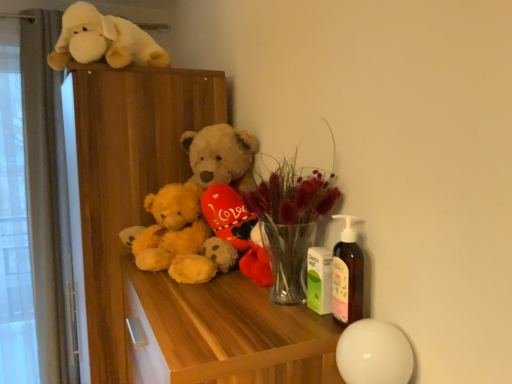
Question: Which direction should I rotate to face fluffy yellow teddy bear at center, the first teddy bear viewed from the right, — up or down?

Choices:
 (A) down
 (B) up

Answer: (A)

Question: Does translucent glass vase at center have a lesser width compared to wooden dresser at upper left?

Choices:
 (A) no
 (B) yes

Answer: (B)

Question: From a real-world perspective, does translucent glass vase at center stand above wooden dresser at upper left?

Choices:
 (A) yes
 (B) no

Answer: (A)

Question: Is translucent glass vase at center facing away from wooden dresser at upper left?

Choices:
 (A) yes
 (B) no

Answer: (B)

Question: Is translucent glass vase at center positioned behind wooden dresser at upper left?

Choices:
 (A) yes
 (B) no

Answer: (B)

Question: Is translucent glass vase at center to the left of wooden dresser at upper left from the viewer's perspective?

Choices:
 (A) yes
 (B) no

Answer: (B)

Question: Is translucent glass vase at center beside wooden dresser at upper left?

Choices:
 (A) yes
 (B) no

Answer: (B)

Question: Is the depth of wooden dresser at upper left greater than that of fluffy yellow teddy bear at center, the second teddy bear in the right-to-left sequence?

Choices:
 (A) yes
 (B) no

Answer: (A)

Question: Can you confirm if wooden dresser at upper left is shorter than fluffy yellow teddy bear at center, the second teddy bear in the right-to-left sequence?

Choices:
 (A) yes
 (B) no

Answer: (B)

Question: From the image's perspective, is wooden dresser at upper left located above fluffy yellow teddy bear at center, which is counted as the 1th teddy bear, starting from the left?

Choices:
 (A) no
 (B) yes

Answer: (A)

Question: Can you confirm if wooden dresser at upper left is taller than fluffy yellow teddy bear at center, the second teddy bear in the right-to-left sequence?

Choices:
 (A) no
 (B) yes

Answer: (B)

Question: Is fluffy yellow teddy bear at center, the second teddy bear in the right-to-left sequence, at the back of wooden dresser at upper left?

Choices:
 (A) no
 (B) yes

Answer: (A)

Question: Considering the relative sizes of wooden dresser at upper left and fluffy yellow teddy bear at center, the second teddy bear in the right-to-left sequence, in the image provided, is wooden dresser at upper left smaller than fluffy yellow teddy bear at center, the second teddy bear in the right-to-left sequence,?

Choices:
 (A) yes
 (B) no

Answer: (B)

Question: Is translucent glass vase at center smaller than fluffy yellow teddy bear at center, the first teddy bear viewed from the right?

Choices:
 (A) yes
 (B) no

Answer: (A)